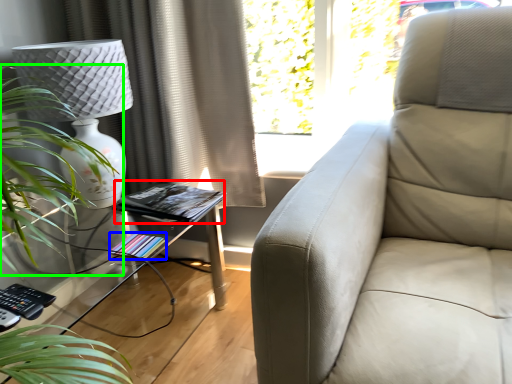
Question: Considering the real-world distances, which object is farthest from book (highlighted by a red box)? book (highlighted by a blue box) or houseplant (highlighted by a green box)?

Choices:
 (A) book
 (B) houseplant

Answer: (B)